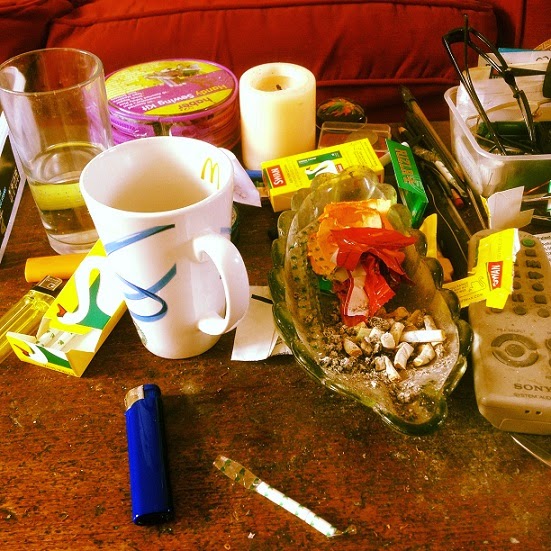
Image resolution: width=551 pixels, height=551 pixels. I want to click on candle, so click(x=261, y=106).